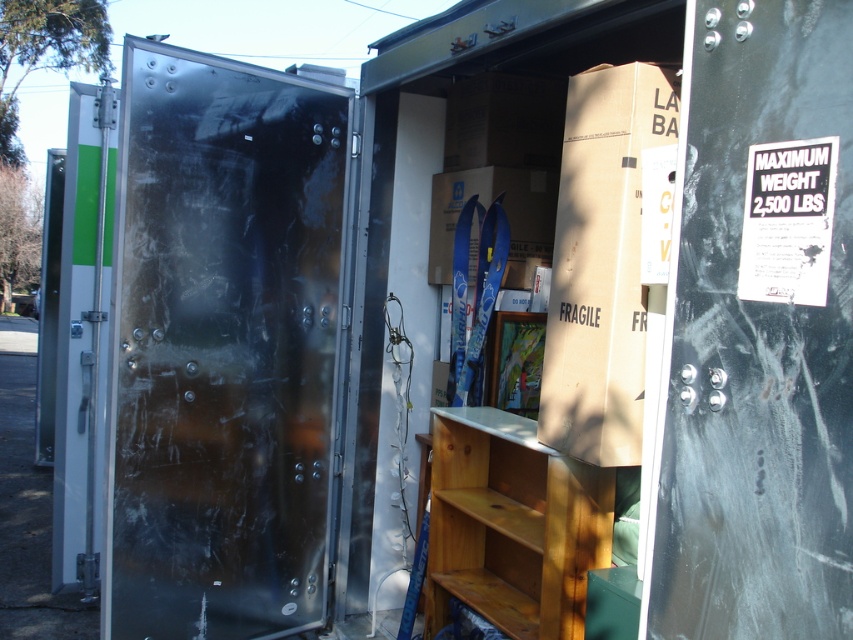
You are a delivery driver who just arrived at a customer location. You need to unload the items from the truck. Which object is located at the coordinate point (223, 346)?

The metallic silver door at left is located at point (223, 346).

Consider the image. You are a delivery person who needs to unload the brown cardboard box at center from the back of the moving truck. Based on its position, can you estimate whether it is closer to the front or the back of the truck?

The brown cardboard box at center is located at point coordinates, so it is positioned closer to the back of the truck since the coordinates suggest it is near the center but closer to the back area.